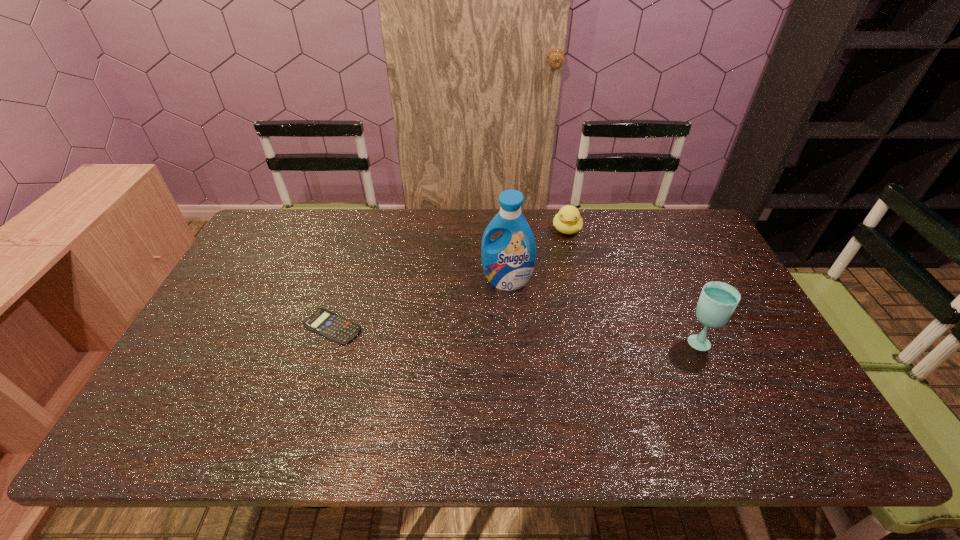
What are the coordinates of `vacant spot on the desktop that is between the leftmost object and the glass and is positioned at the beak of the second object from right to left` in the screenshot? It's located at pyautogui.click(x=548, y=334).

At what (x,y) coordinates should I click in order to perform the action: click on vacant spot on the desktop that is between the shortest object and the rightmost object and is positioned on the front-facing side of the detergent. Please return your answer as a coordinate pair (x, y). Looking at the image, I should click on (491, 332).